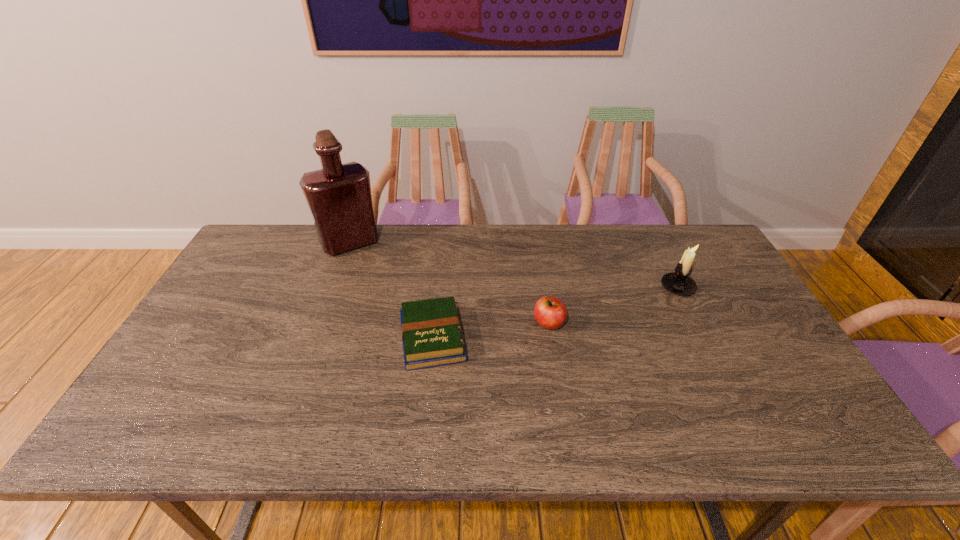
Identify the location of free space located on the back of the apple. (543, 288).

You are a GUI agent. You are given a task and a screenshot of the screen. Output one action in this format:
    pyautogui.click(x=<x>, y=<y>)
    Task: Click on the free spot located on the right of the third object from right to left
    The image size is (960, 540).
    Given the screenshot: What is the action you would take?
    pyautogui.click(x=607, y=338)

Identify the location of object located in the far edge section of the desktop. (339, 197).

Locate an element on the screen. This screenshot has height=540, width=960. object that is at the right edge is located at coordinates (678, 282).

The width and height of the screenshot is (960, 540). I want to click on vacant area at the far edge, so tap(454, 235).

Where is `vacant area at the near edge of the desktop`? vacant area at the near edge of the desktop is located at coordinates (237, 434).

You are a GUI agent. You are given a task and a screenshot of the screen. Output one action in this format:
    pyautogui.click(x=<x>, y=<y>)
    Task: Click on the vacant space at the left edge
    This screenshot has height=540, width=960.
    Given the screenshot: What is the action you would take?
    tap(237, 296)

Where is `vacant region at the right edge of the desktop`? This screenshot has width=960, height=540. vacant region at the right edge of the desktop is located at coordinates (718, 276).

Where is `vacant area at the far left corner of the desktop`? The image size is (960, 540). vacant area at the far left corner of the desktop is located at coordinates (247, 248).

In the image, there is a desktop. Identify the location of vacant region at the far right corner. (655, 225).